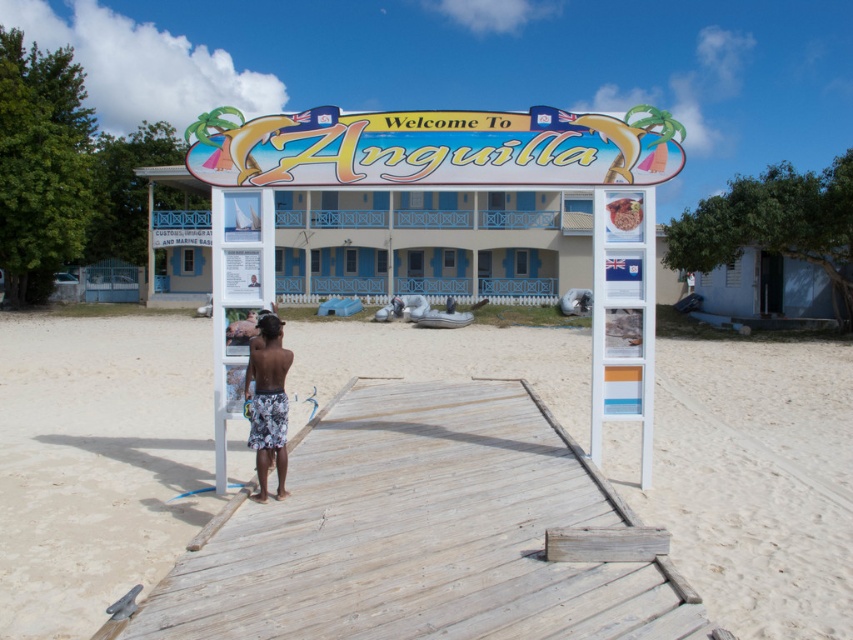
Is point (231, 620) more distant than point (277, 387)?

No, (231, 620) is in front of (277, 387).

Where is `weathered wood dock at center`? This screenshot has height=640, width=853. weathered wood dock at center is located at coordinates (426, 532).

Between point (682, 586) and point (277, 460), which one is positioned in front?

Positioned in front is point (682, 586).

In order to click on weathered wood dock at center in this screenshot , I will do `click(426, 532)`.